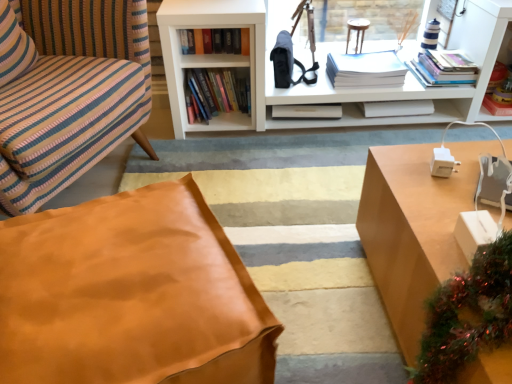
Question: Is striped fabric pillow at left to the right of hardcover books at upper right, which ranks as the 5th book in left-to-right order, from the viewer's perspective?

Choices:
 (A) yes
 (B) no

Answer: (B)

Question: Considering the relative positions of striped fabric pillow at left and hardcover books at upper right, which ranks as the 5th book in left-to-right order, in the image provided, is striped fabric pillow at left to the left of hardcover books at upper right, which ranks as the 5th book in left-to-right order, from the viewer's perspective?

Choices:
 (A) yes
 (B) no

Answer: (A)

Question: Is striped fabric pillow at left bigger than hardcover books at upper right, which ranks as the 5th book in left-to-right order?

Choices:
 (A) no
 (B) yes

Answer: (B)

Question: Does striped fabric pillow at left have a lesser width compared to hardcover books at upper right, placed as the 1th book when sorted from right to left?

Choices:
 (A) yes
 (B) no

Answer: (A)

Question: Does striped fabric pillow at left lie in front of hardcover books at upper right, which ranks as the 5th book in left-to-right order?

Choices:
 (A) no
 (B) yes

Answer: (B)

Question: Would you say hardcover books at center, which is counted as the second book, starting from the left, is to the left or to the right of white paper stack at upper center, which ranks as the 3th book in left-to-right order, in the picture?

Choices:
 (A) right
 (B) left

Answer: (B)

Question: In the image, is hardcover books at center, the 4th book from the right, positioned in front of or behind white paper stack at upper center, which ranks as the 3th book in left-to-right order?

Choices:
 (A) front
 (B) behind

Answer: (A)

Question: Is hardcover books at center, which is counted as the second book, starting from the left, situated inside white paper stack at upper center, the third book positioned from the right, or outside?

Choices:
 (A) inside
 (B) outside

Answer: (B)

Question: Considering the positions of point (231, 86) and point (332, 56), is point (231, 86) closer or farther from the camera than point (332, 56)?

Choices:
 (A) farther
 (B) closer

Answer: (B)

Question: Is leather at lower left inside the boundaries of striped fabric pillow at left, or outside?

Choices:
 (A) outside
 (B) inside

Answer: (A)

Question: Is point (30, 188) closer or farther from the camera than point (32, 46)?

Choices:
 (A) farther
 (B) closer

Answer: (B)

Question: Is leather at lower left to the left or to the right of striped fabric pillow at left in the image?

Choices:
 (A) right
 (B) left

Answer: (A)

Question: From the image's perspective, relative to striped fabric pillow at left, is leather at lower left above or below?

Choices:
 (A) below
 (B) above

Answer: (A)

Question: Relative to striped fabric pillow at left, is white matte bookcase at upper center in front or behind?

Choices:
 (A) front
 (B) behind

Answer: (B)

Question: Choose the correct answer: Is white matte bookcase at upper center inside striped fabric pillow at left or outside it?

Choices:
 (A) outside
 (B) inside

Answer: (A)